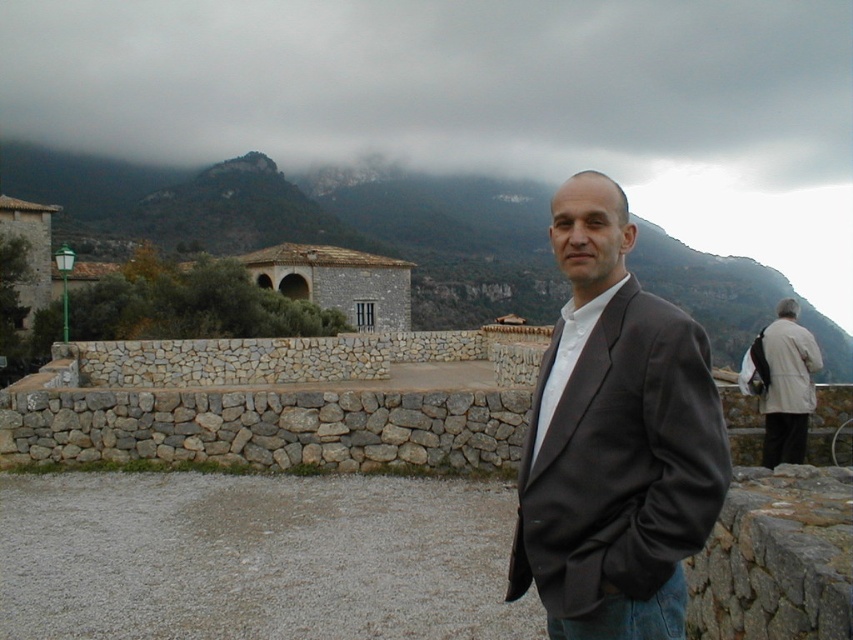
Question: Based on their relative distances, which object is farther from the rocky mountain at upper center?

Choices:
 (A) matte black suit at center
 (B) light beige coat at right

Answer: (B)

Question: Does matte black suit at center have a larger size compared to rocky mountain at upper center?

Choices:
 (A) yes
 (B) no

Answer: (B)

Question: Observing the image, what is the correct spatial positioning of matte black suit at center in reference to rocky mountain at upper center?

Choices:
 (A) above
 (B) below

Answer: (B)

Question: Which object appears closest to the camera in this image?

Choices:
 (A) matte black suit at center
 (B) light beige coat at right
 (C) rocky mountain at upper center

Answer: (A)

Question: Which point is farther to the camera?

Choices:
 (A) (543, 221)
 (B) (778, 392)
 (C) (671, 545)

Answer: (A)

Question: Is matte black suit at center smaller than rocky mountain at upper center?

Choices:
 (A) yes
 (B) no

Answer: (A)